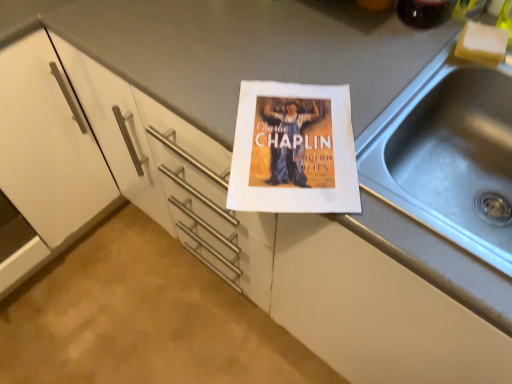
Question: Considering the relative sizes of white sponge at upper right and translucent glass beverage at upper right in the image provided, is white sponge at upper right bigger than translucent glass beverage at upper right?

Choices:
 (A) no
 (B) yes

Answer: (A)

Question: From a real-world perspective, is white sponge at upper right positioned under translucent glass beverage at upper right based on gravity?

Choices:
 (A) yes
 (B) no

Answer: (A)

Question: From the image's perspective, is white sponge at upper right beneath translucent glass beverage at upper right?

Choices:
 (A) yes
 (B) no

Answer: (A)

Question: Would you say white sponge at upper right contains translucent glass beverage at upper right?

Choices:
 (A) yes
 (B) no

Answer: (B)

Question: Can you confirm if white sponge at upper right is positioned to the left of translucent glass beverage at upper right?

Choices:
 (A) no
 (B) yes

Answer: (A)

Question: Is white sponge at upper right oriented towards translucent glass beverage at upper right?

Choices:
 (A) yes
 (B) no

Answer: (B)

Question: From a real-world perspective, is white sponge at upper right below silver metallic sink at right?

Choices:
 (A) no
 (B) yes

Answer: (A)

Question: Is white sponge at upper right positioned beyond the bounds of silver metallic sink at right?

Choices:
 (A) yes
 (B) no

Answer: (B)

Question: From the image's perspective, is white sponge at upper right beneath silver metallic sink at right?

Choices:
 (A) yes
 (B) no

Answer: (B)

Question: Does white sponge at upper right lie behind silver metallic sink at right?

Choices:
 (A) yes
 (B) no

Answer: (A)

Question: Is white sponge at upper right positioned in front of silver metallic sink at right?

Choices:
 (A) no
 (B) yes

Answer: (A)

Question: From the image's perspective, would you say white sponge at upper right is positioned over silver metallic sink at right?

Choices:
 (A) yes
 (B) no

Answer: (A)

Question: From the image's perspective, does translucent glass beverage at upper right appear lower than white sponge at upper right?

Choices:
 (A) yes
 (B) no

Answer: (B)